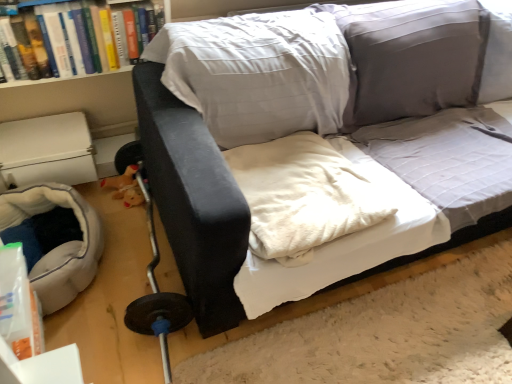
Question: In terms of size, does soft gray fabric bean bag at lower left appear bigger or smaller than hardcover book at upper left?

Choices:
 (A) big
 (B) small

Answer: (A)

Question: In terms of height, does soft gray fabric bean bag at lower left look taller or shorter compared to hardcover book at upper left?

Choices:
 (A) short
 (B) tall

Answer: (A)

Question: Which object is the farthest from the velvet black couch at center?

Choices:
 (A) soft gray fabric bean bag at lower left
 (B) white soft blanket at center
 (C) hardcover book at upper left

Answer: (A)

Question: Which is farther from the hardcover book at upper left?

Choices:
 (A) soft gray fabric bean bag at lower left
 (B) white soft blanket at center
 (C) velvet black couch at center

Answer: (C)